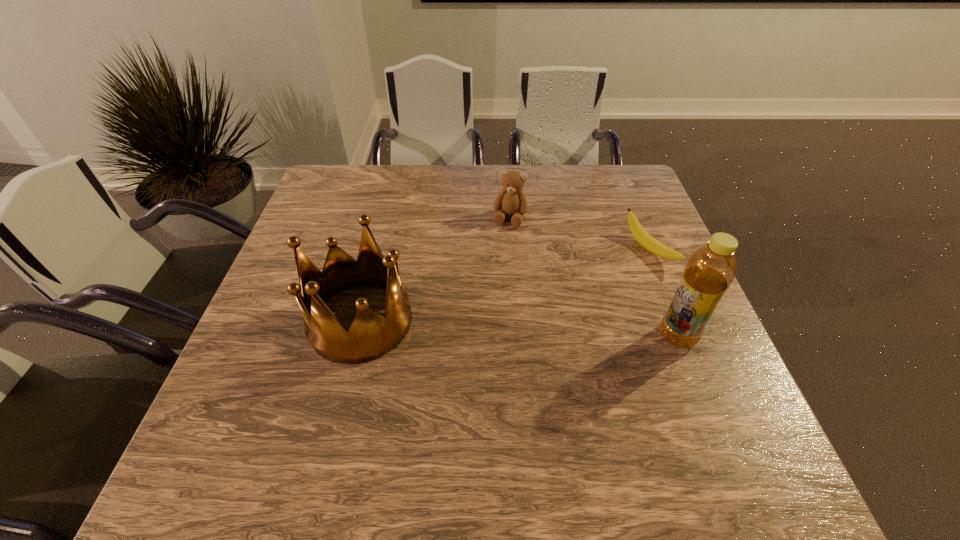
Find the location of `vacant space on the desktop that is between the leftmost object and the bottle and is positioned on the front-facing side of the second shortest object`. vacant space on the desktop that is between the leftmost object and the bottle and is positioned on the front-facing side of the second shortest object is located at coordinates (478, 327).

Locate an element on the screen. The image size is (960, 540). vacant space on the desktop that is between the second tallest object and the bottle and is positioned on the upward curve of the shortest object is located at coordinates (469, 326).